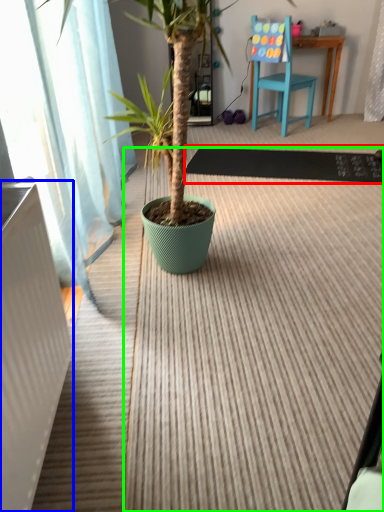
Question: Which is farther away from doormat (highlighted by a red box)? radiator (highlighted by a blue box) or doormat (highlighted by a green box)?

Choices:
 (A) radiator
 (B) doormat

Answer: (A)